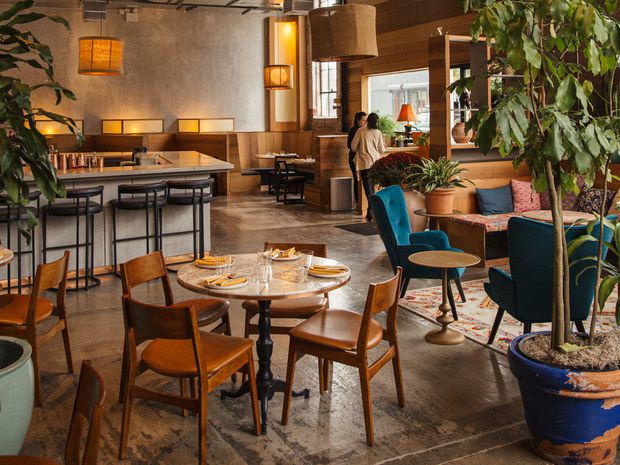
Find the location of `bar stool chairs`. bar stool chairs is located at coordinates (129, 196), (180, 196), (92, 204), (32, 207).